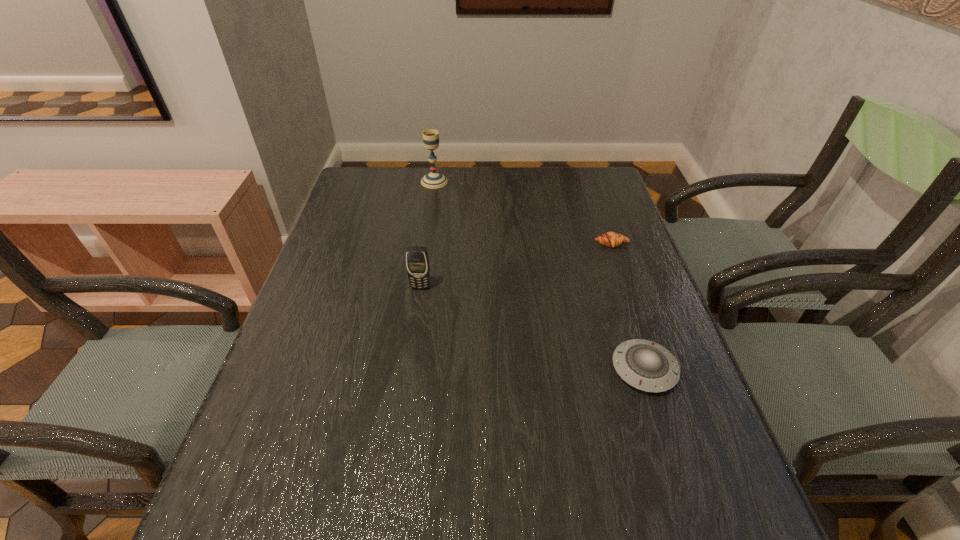
The width and height of the screenshot is (960, 540). I want to click on free space between the pastry and the saucer, so click(x=628, y=307).

This screenshot has height=540, width=960. Find the location of `unoccupied area between the third nearest object and the saucer`. unoccupied area between the third nearest object and the saucer is located at coordinates (628, 307).

This screenshot has height=540, width=960. I want to click on free area in between the second farthest object and the farthest object, so click(522, 213).

I want to click on free space between the chalice and the second nearest object, so click(x=427, y=234).

The image size is (960, 540). Identify the location of empty location between the third nearest object and the saucer. (628, 307).

Where is `vacant space in between the nearest object and the third shortest object`? vacant space in between the nearest object and the third shortest object is located at coordinates (533, 328).

The height and width of the screenshot is (540, 960). I want to click on free point between the farthest object and the third nearest object, so point(522,213).

Where is `vacant point located between the chalice and the nearest object`? The image size is (960, 540). vacant point located between the chalice and the nearest object is located at coordinates (540, 275).

Identify the location of empty location between the tallest object and the nearest object. The width and height of the screenshot is (960, 540). (540, 275).

Locate an element on the screen. The width and height of the screenshot is (960, 540). object identified as the closest to the second tallest object is located at coordinates (645, 365).